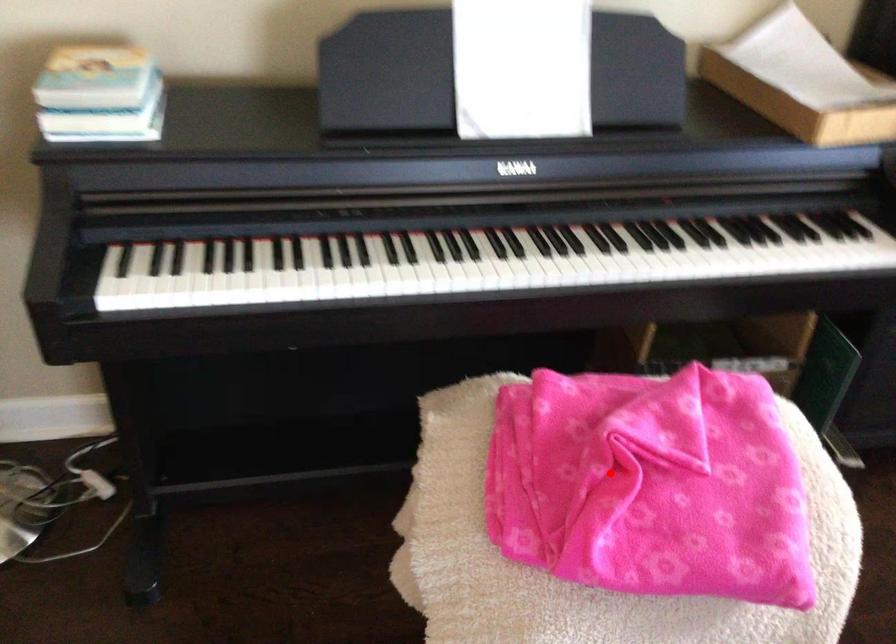
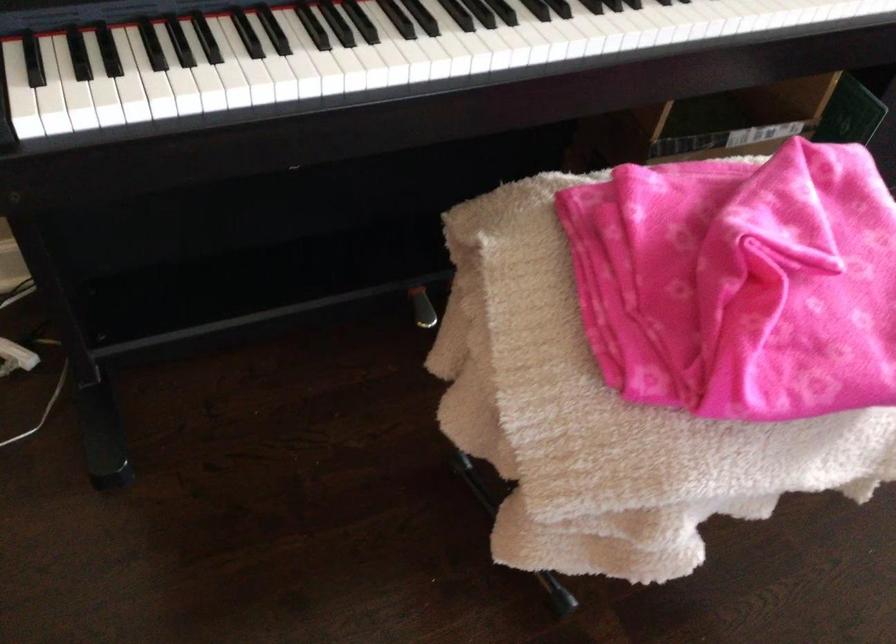
In the second image, find the point that corresponds to the highlighted location in the first image.

(739, 283)